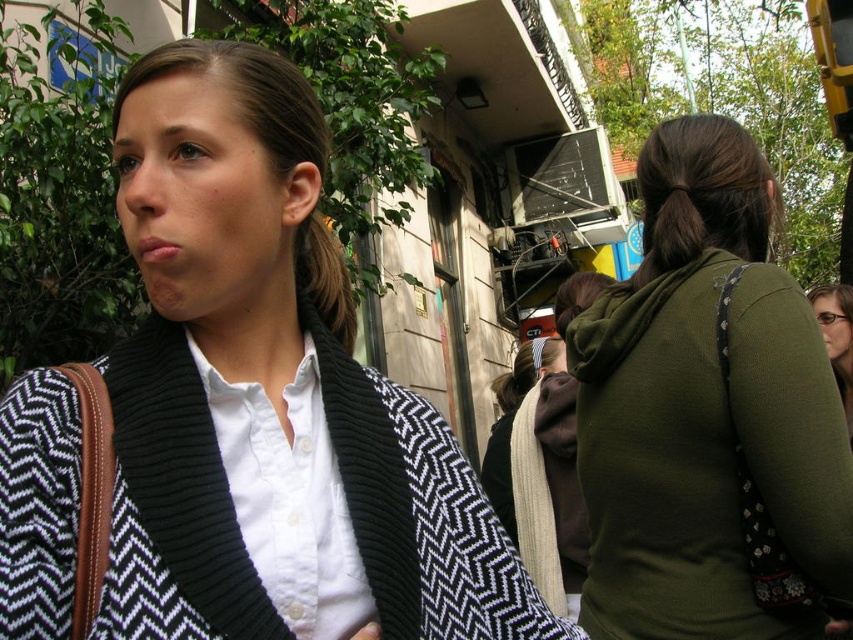
You are an artist sketching this scene. You want to ensure the proportions between the white matte shirt at center and the black textured sweater at upper left are accurate. Which object should you draw first to maintain proper scale?

The black textured sweater at upper left should be drawn first because it is taller than the white matte shirt at center, ensuring the proportions are correctly scaled.

You are a photographer setting up a tripod to capture the scene. You notice the green fabric hoodie at upper right and the matte black sweater at center. Which object is closer to the camera?

The matte black sweater at center is closer to the camera because it is positioned closer to the photographer compared to the green fabric hoodie at upper right, which is farther away.